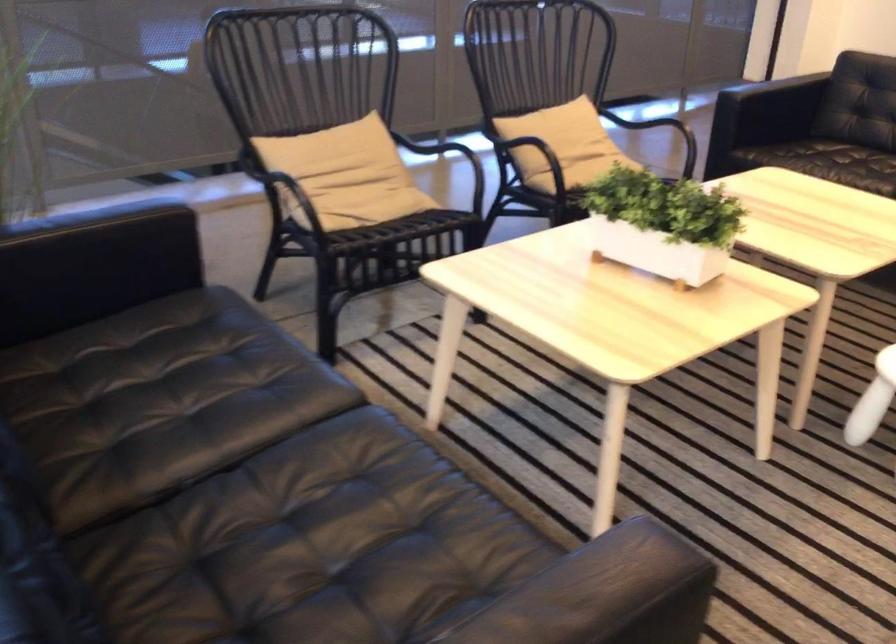
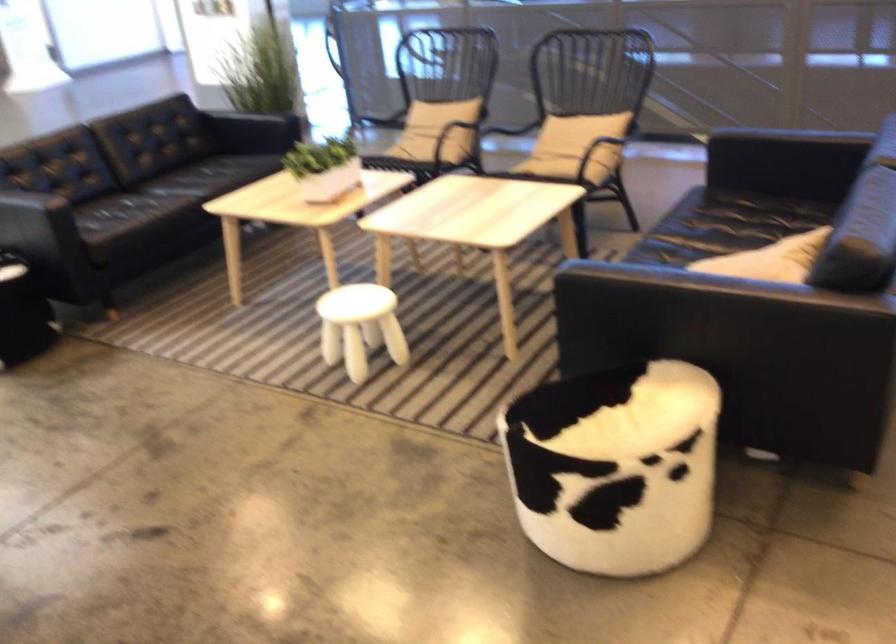
Locate, in the second image, the point that corresponds to point (679, 216) in the first image.

(323, 167)